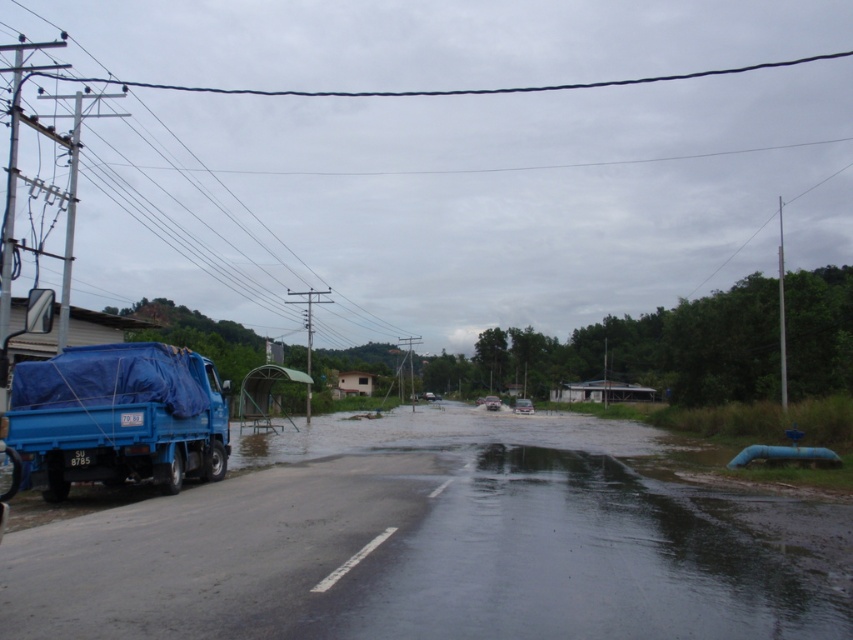
Is blue tarpaulin flood at left thinner than blue tarpaulin truck at left?

No, blue tarpaulin flood at left is not thinner than blue tarpaulin truck at left.

Which of these two, blue tarpaulin flood at left or blue tarpaulin truck at left, stands shorter?

Standing shorter between the two is blue tarpaulin truck at left.

Is point (585, 483) positioned before point (184, 416)?

No, it is not.

Identify the location of blue tarpaulin flood at left. Image resolution: width=853 pixels, height=640 pixels. (x=415, y=545).

Is black wire at upper center shorter than blue tarpaulin flood at left?

No, black wire at upper center is not shorter than blue tarpaulin flood at left.

Who is lower down, black wire at upper center or blue tarpaulin flood at left?

blue tarpaulin flood at left is below.

The height and width of the screenshot is (640, 853). Find the location of `black wire at upper center`. black wire at upper center is located at coordinates (454, 198).

Between point (354, 333) and point (173, 378), which one is positioned in front?

Point (173, 378) is more forward.

At what (x,y) coordinates should I click in order to perform the action: click on black wire at upper center. Please return your answer as a coordinate pair (x, y). Looking at the image, I should click on (454, 198).